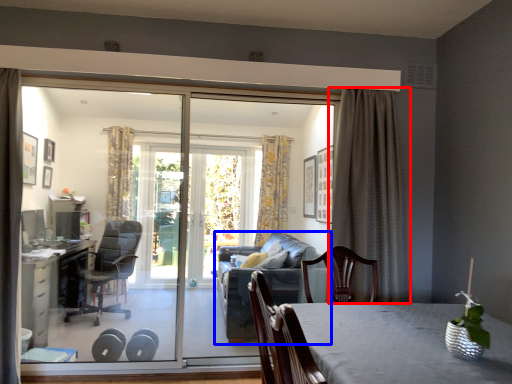
Question: Which point is further to the camera, curtain (highlighted by a red box) or studio couch (highlighted by a blue box)?

Choices:
 (A) curtain
 (B) studio couch

Answer: (B)